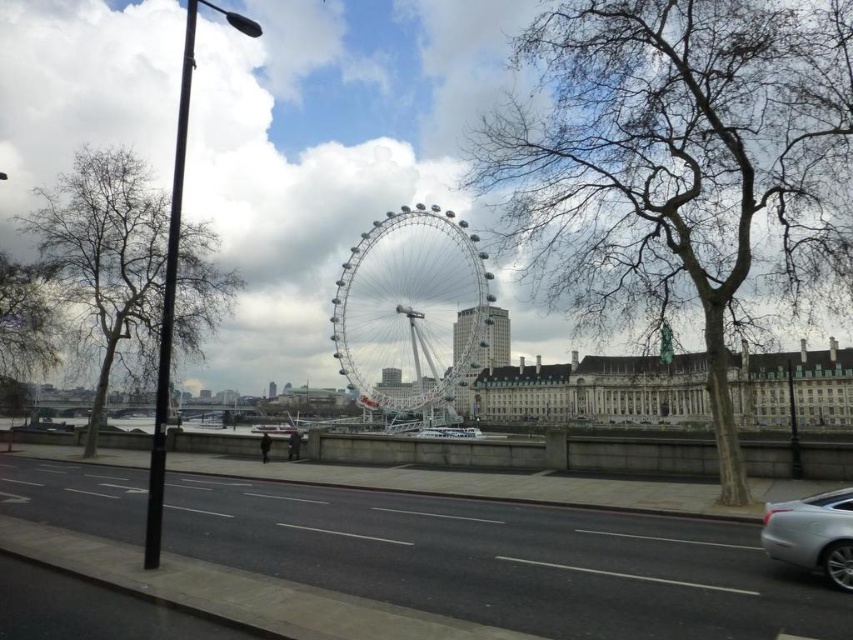
You are standing on the road and want to take a photo of both the white metallic ferris wheel at center and the metallic silver tower at center. Which object should you frame first in your camera viewfinder to ensure both are captured in the same shot?

You should frame the white metallic ferris wheel at center first because it might be wider than the metallic silver tower at center, so starting with the wider object ensures both fit in the frame.

You are a tourist standing on the road near the gray textured tree at left and the metallic silver tower at center. Which object would block your view of the sky if you look upward?

The gray textured tree at left is much taller than the metallic silver tower at center, so it would block your view of the sky when looking upward.